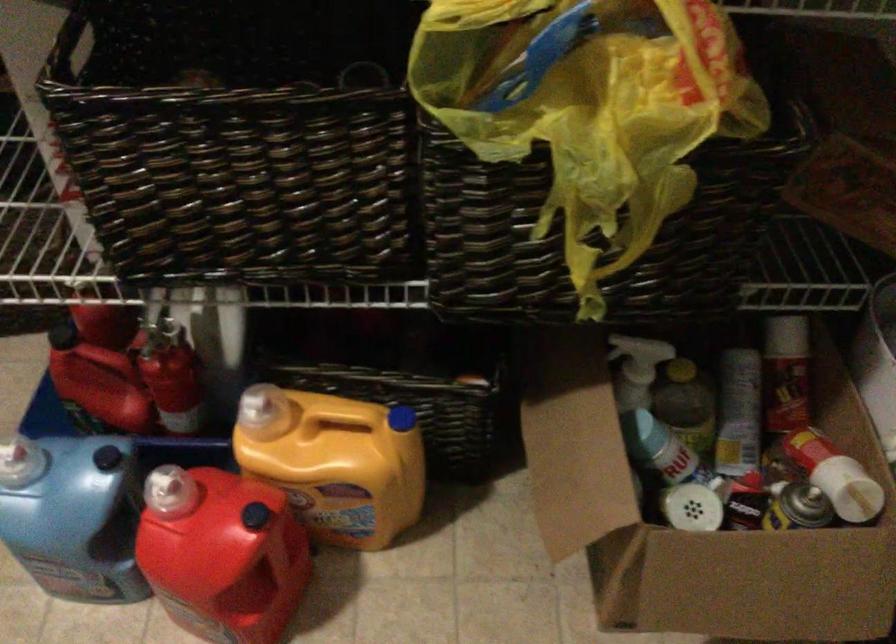
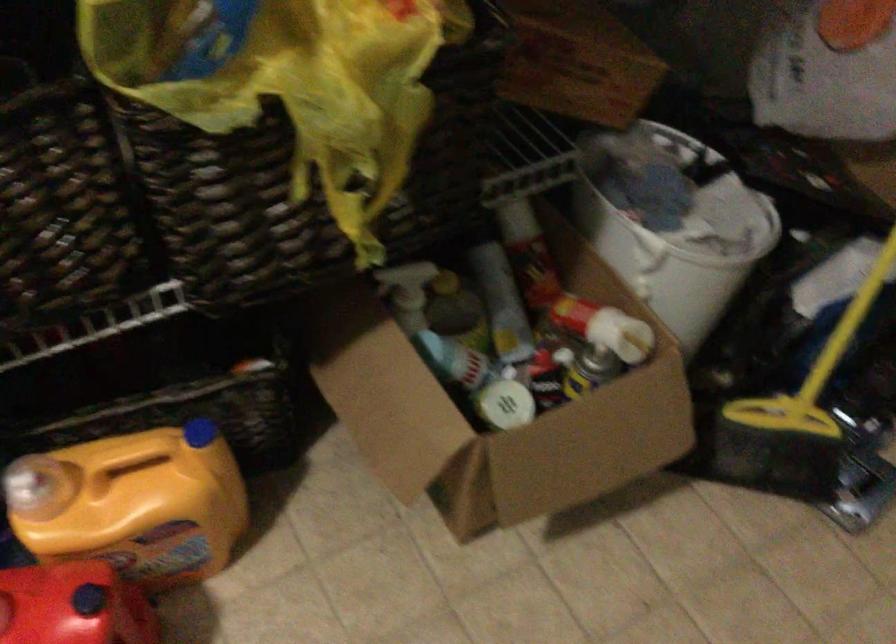
Where in the second image is the point corresponding to [325,455] from the first image?

(133, 504)